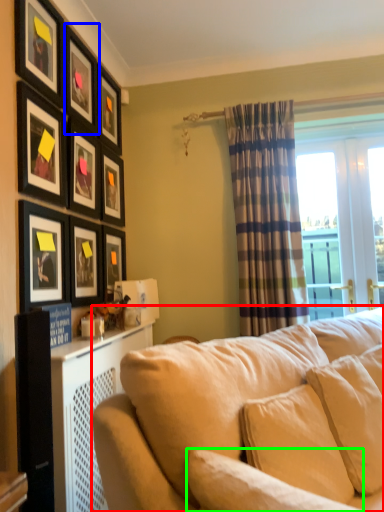
Question: Estimate the real-world distances between objects in this image. Which object is closer to studio couch (highlighted by a red box), picture frame (highlighted by a blue box) or pillow (highlighted by a green box)?

Choices:
 (A) picture frame
 (B) pillow

Answer: (B)